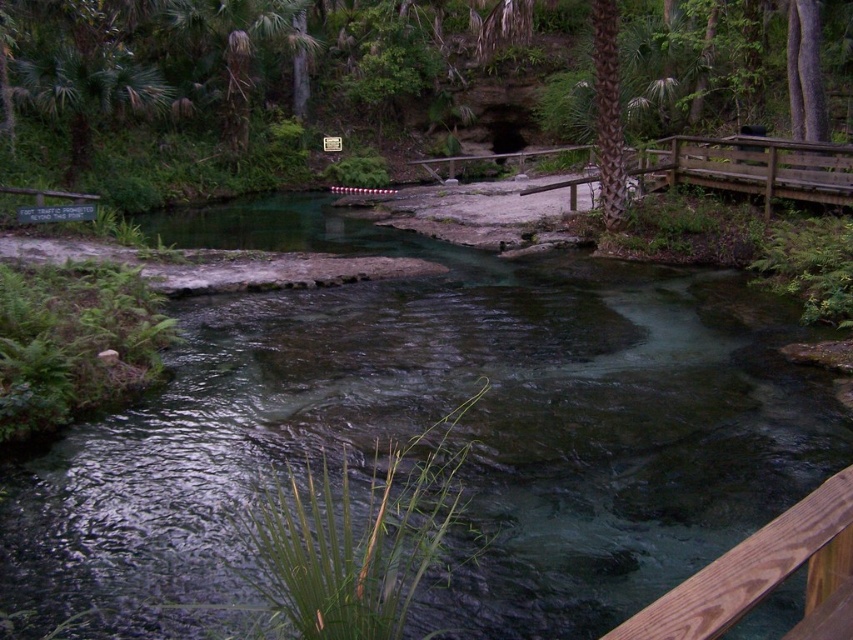
Is clear water stream at center to the left of brown textured palm tree at upper center from the viewer's perspective?

Correct, you'll find clear water stream at center to the left of brown textured palm tree at upper center.

Can you confirm if clear water stream at center is positioned to the right of brown textured palm tree at upper center?

Incorrect, clear water stream at center is not on the right side of brown textured palm tree at upper center.

Is point (172, 413) farther from viewer compared to point (596, 93)?

No, it is not.

Where is `clear water stream at center`? The height and width of the screenshot is (640, 853). clear water stream at center is located at coordinates (431, 422).

Does brown wood rail at lower right appear on the left side of brown textured palm tree at upper center?

Yes, brown wood rail at lower right is to the left of brown textured palm tree at upper center.

Does brown wood rail at lower right appear over brown textured palm tree at upper center?

No, brown wood rail at lower right is not above brown textured palm tree at upper center.

Does point (796, 628) come closer to viewer compared to point (607, 35)?

Yes, it is.

Identify the location of brown wood rail at lower right. The image size is (853, 640). (766, 576).

Between point (616, 509) and point (811, 561), which one is positioned in front?

Positioned in front is point (811, 561).

Can you confirm if clear water stream at center is thinner than brown wood rail at lower right?

No.

Is point (674, 532) in front of point (814, 531)?

No, it is not.

Image resolution: width=853 pixels, height=640 pixels. In order to click on clear water stream at center in this screenshot , I will do `click(431, 422)`.